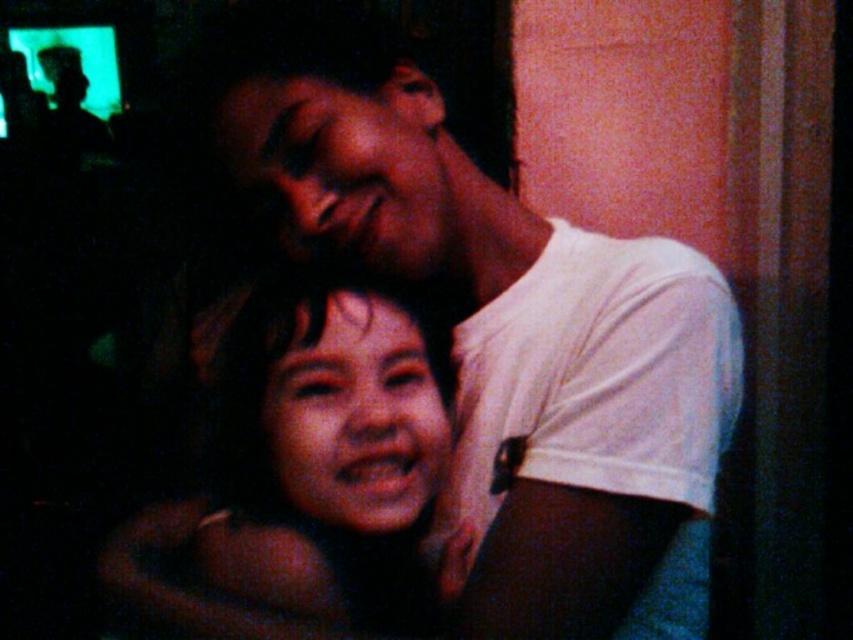
Between white matte shirt at upper right and smooth skin face at center, which one appears on the right side from the viewer's perspective?

white matte shirt at upper right

Image resolution: width=853 pixels, height=640 pixels. Describe the element at coordinates (495, 330) in the screenshot. I see `white matte shirt at upper right` at that location.

Between point (281, 122) and point (401, 442), which one is positioned behind?

The point (401, 442) is more distant.

At what (x,y) coordinates should I click in order to perform the action: click on white matte shirt at upper right. Please return your answer as a coordinate pair (x, y). The image size is (853, 640). Looking at the image, I should click on (495, 330).